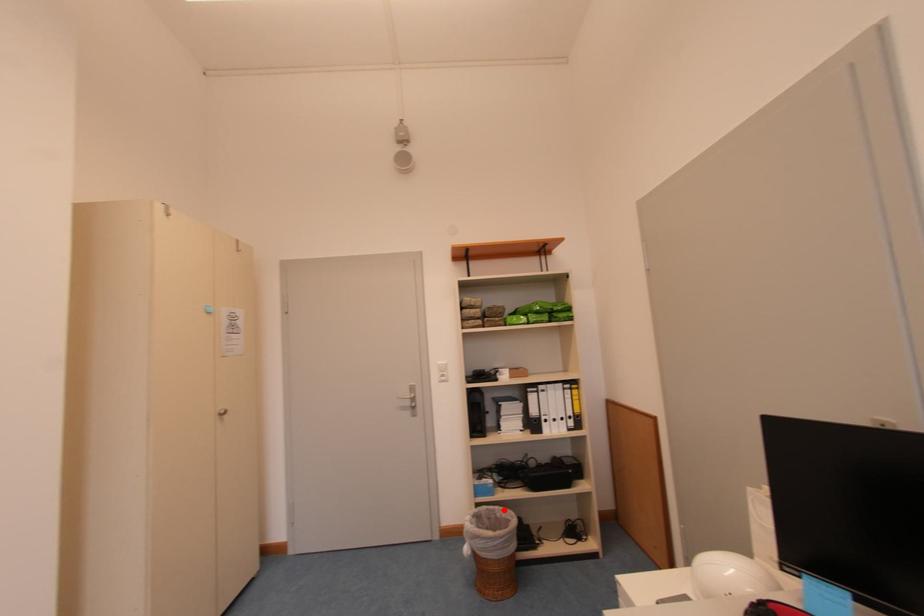
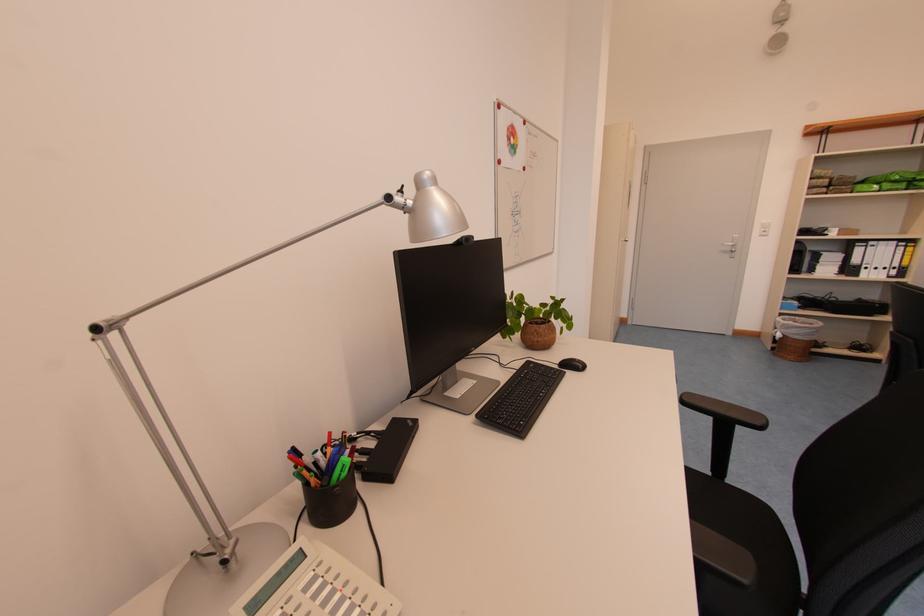
Question: I am providing you with two images of the same scene from different viewpoints. Given a red point in image1, look at the same physical point in image2. Is it:

Choices:
 (A) Closer to the viewpoint
 (B) Farther from the viewpoint

Answer: (A)